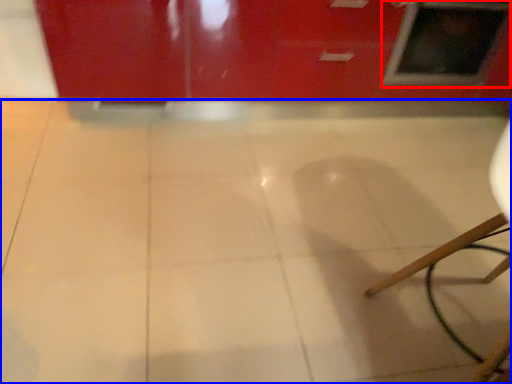
Question: Which object is closer to the camera taking this photo, window (highlighted by a red box) or ceramic tile (highlighted by a blue box)?

Choices:
 (A) window
 (B) ceramic tile

Answer: (B)